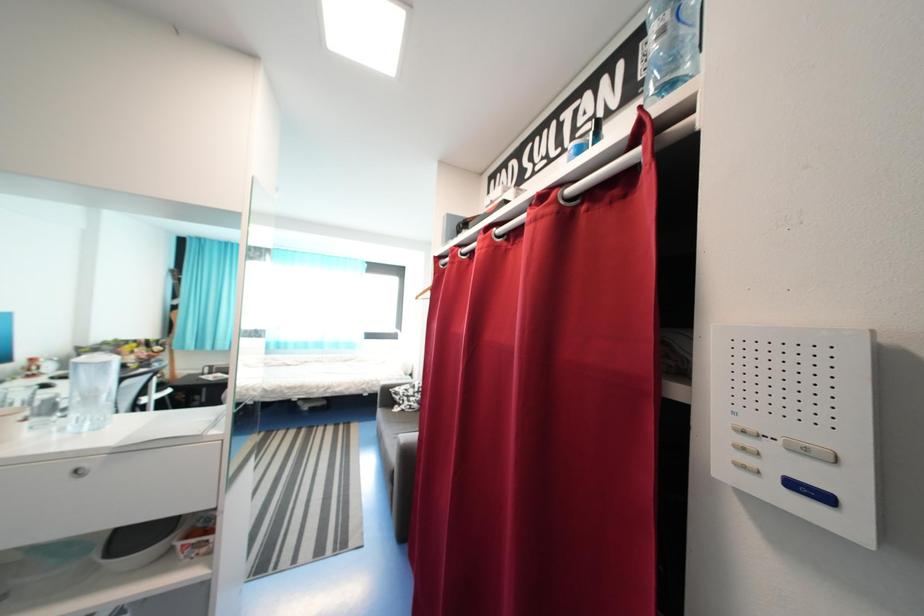
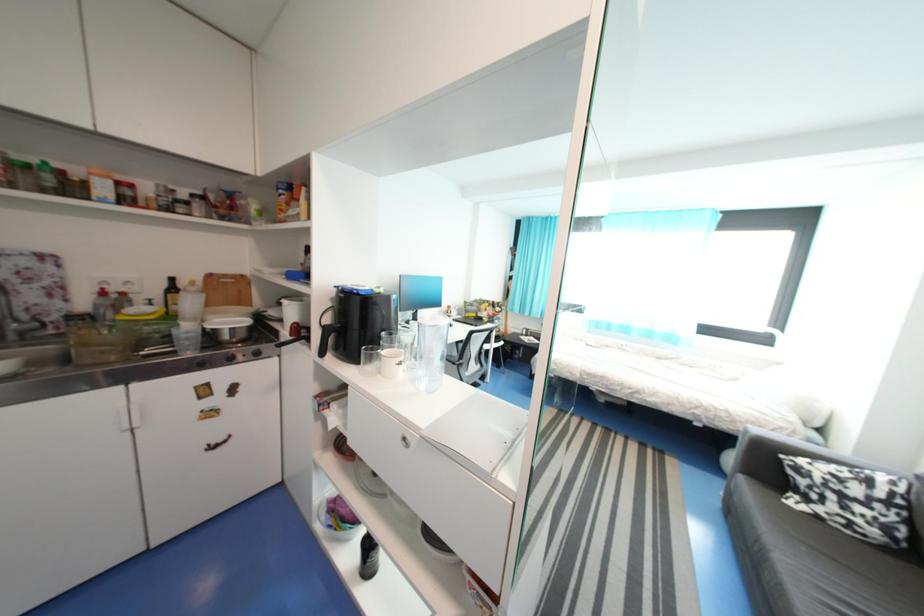
Question: The camera is either moving clockwise (left) or counter-clockwise (right) around the object. The first image is from the beginning of the video and the second image is from the end. Is the camera moving left or right when shooting the video?

Choices:
 (A) Left
 (B) Right

Answer: (B)